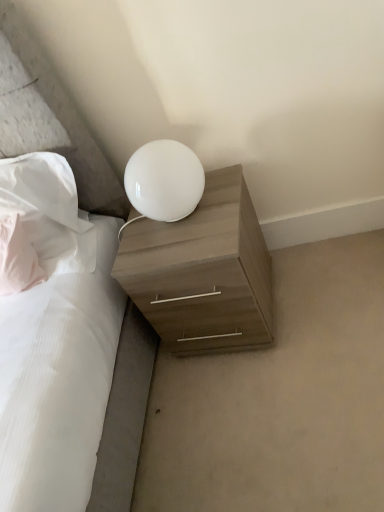
Question: Is pink fabric pillow at left, which is counted as the first pillow, starting from the left, in front of white glossy lamp at upper center?

Choices:
 (A) no
 (B) yes

Answer: (A)

Question: Does pink fabric pillow at left, which is counted as the first pillow, starting from the left, have a lesser height compared to white glossy lamp at upper center?

Choices:
 (A) yes
 (B) no

Answer: (B)

Question: Is pink fabric pillow at left, which is counted as the first pillow, starting from the left, located outside white glossy lamp at upper center?

Choices:
 (A) yes
 (B) no

Answer: (A)

Question: Is pink fabric pillow at left, which is counted as the first pillow, starting from the left, aimed at white glossy lamp at upper center?

Choices:
 (A) no
 (B) yes

Answer: (A)

Question: Would you say white glossy lamp at upper center is part of pink fabric pillow at left, acting as the second pillow starting from the right,'s contents?

Choices:
 (A) yes
 (B) no

Answer: (B)

Question: Is pink fabric pillow at left, acting as the second pillow starting from the right, positioned far away from white glossy lamp at upper center?

Choices:
 (A) no
 (B) yes

Answer: (A)

Question: From the image's perspective, would you say white glossy lamp at upper center is positioned over pink fabric pillow at left, which is counted as the first pillow, starting from the left?

Choices:
 (A) yes
 (B) no

Answer: (A)

Question: Is white glossy lamp at upper center at the left side of pink fabric pillow at left, acting as the second pillow starting from the right?

Choices:
 (A) no
 (B) yes

Answer: (A)

Question: Is white glossy lamp at upper center positioned with its back to pink fabric pillow at left, which is counted as the first pillow, starting from the left?

Choices:
 (A) no
 (B) yes

Answer: (A)

Question: Is white glossy lamp at upper center shorter than pink fabric pillow at left, acting as the second pillow starting from the right?

Choices:
 (A) yes
 (B) no

Answer: (A)

Question: From a real-world perspective, is white glossy lamp at upper center on pink fabric pillow at left, acting as the second pillow starting from the right?

Choices:
 (A) yes
 (B) no

Answer: (A)

Question: Considering the relative positions of white glossy lamp at upper center and pink fabric pillow at left, acting as the second pillow starting from the right, in the image provided, is white glossy lamp at upper center to the right of pink fabric pillow at left, acting as the second pillow starting from the right, from the viewer's perspective?

Choices:
 (A) no
 (B) yes

Answer: (B)

Question: From a real-world perspective, does white fabric pillow at upper left, which appears as the 2th pillow when viewed from the left, stand above white glossy lamp at upper center?

Choices:
 (A) yes
 (B) no

Answer: (A)